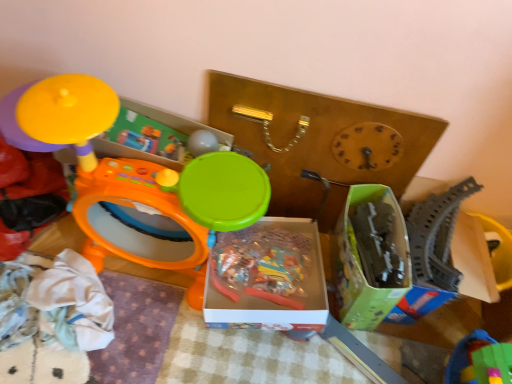
Describe the element at coordinates (25, 181) in the screenshot. This screenshot has height=384, width=512. I see `matte yellow toy at upper left, placed as the 1th toy when sorted from left to right` at that location.

This screenshot has width=512, height=384. Find the location of `green plastic blocks at lower right, which is counted as the 2th toy, starting from the right`. green plastic blocks at lower right, which is counted as the 2th toy, starting from the right is located at coordinates (479, 359).

I want to click on green cardboard box at center-right, the 1th storage box when ordered from right to left, so click(x=370, y=257).

Locate an element on the screen. matte yellow toy at upper left, which is the fourth toy in right-to-left order is located at coordinates 25,181.

Considering the positions of objects matte yellow toy at upper left, which is the fourth toy in right-to-left order, and translucent plastic box at center, the 2th storage box in the right-to-left sequence, in the image provided, who is in front, matte yellow toy at upper left, which is the fourth toy in right-to-left order, or translucent plastic box at center, the 2th storage box in the right-to-left sequence,?

matte yellow toy at upper left, which is the fourth toy in right-to-left order, is closer to the camera.

Considering the relative sizes of matte yellow toy at upper left, placed as the 1th toy when sorted from left to right, and translucent plastic box at center, the 2th storage box in the right-to-left sequence, in the image provided, is matte yellow toy at upper left, placed as the 1th toy when sorted from left to right, smaller than translucent plastic box at center, the 2th storage box in the right-to-left sequence,?

No, matte yellow toy at upper left, placed as the 1th toy when sorted from left to right, is not smaller than translucent plastic box at center, the 2th storage box in the right-to-left sequence.

From a real-world perspective, which object rests below the other?

translucent plastic box at center, which is the first storage box in left-to-right order, from a real-world perspective.

From the image's perspective, which is below, matte yellow toy at upper left, placed as the 1th toy when sorted from left to right, or translucent plastic box at center, which is the first storage box in left-to-right order?

translucent plastic box at center, which is the first storage box in left-to-right order, is shown below in the image.

Can you see translucent plastic box at center, the 2th storage box in the right-to-left sequence, touching green plastic blocks at lower right, the 3th toy viewed from the left?

translucent plastic box at center, the 2th storage box in the right-to-left sequence, and green plastic blocks at lower right, the 3th toy viewed from the left, are not in contact.

In terms of width, does translucent plastic box at center, the 2th storage box in the right-to-left sequence, look wider or thinner when compared to green plastic blocks at lower right, which is counted as the 2th toy, starting from the right?

Considering their sizes, translucent plastic box at center, the 2th storage box in the right-to-left sequence, looks broader than green plastic blocks at lower right, which is counted as the 2th toy, starting from the right.

Who is smaller, translucent plastic box at center, which is the first storage box in left-to-right order, or green plastic blocks at lower right, the 3th toy viewed from the left?

Smaller between the two is green plastic blocks at lower right, the 3th toy viewed from the left.

In the scene shown: From a real-world perspective, which object rests below the other?

From a 3D spatial view, translucent plastic box at center, which is the first storage box in left-to-right order, is below.

Is orange plastic drum at left, positioned as the 2th toy in left-to-right order, in contact with translucent plastic box at center, the 2th storage box in the right-to-left sequence?

There is a gap between orange plastic drum at left, positioned as the 2th toy in left-to-right order, and translucent plastic box at center, the 2th storage box in the right-to-left sequence.

At what (x,y) coordinates should I click in order to perform the action: click on the 2nd storage box behind when counting from the orange plastic drum at left, the 3th toy viewed from the right. Please return your answer as a coordinate pair (x, y). Looking at the image, I should click on (267, 277).

From a real-world perspective, is orange plastic drum at left, positioned as the 2th toy in left-to-right order, above or below translucent plastic box at center, the 2th storage box in the right-to-left sequence?

orange plastic drum at left, positioned as the 2th toy in left-to-right order, is situated higher than translucent plastic box at center, the 2th storage box in the right-to-left sequence, in the real world.

Can you confirm if orange plastic drum at left, the 3th toy viewed from the right, is taller than translucent plastic box at center, the 2th storage box in the right-to-left sequence?

Yes.

From the picture: Who is bigger, gray plastic train track at right, which is the 4th toy in left-to-right order, or translucent plastic box at center, which is the first storage box in left-to-right order?

translucent plastic box at center, which is the first storage box in left-to-right order, is bigger.

There is a translucent plastic box at center, the 2th storage box in the right-to-left sequence. Where is `the 1st toy above it (from the image's perspective)`? This screenshot has width=512, height=384. the 1st toy above it (from the image's perspective) is located at coordinates (436, 236).

Is gray plastic train track at right, which is the 4th toy in left-to-right order, surrounding translucent plastic box at center, which is the first storage box in left-to-right order?

Definitely not — translucent plastic box at center, which is the first storage box in left-to-right order, is not inside gray plastic train track at right, which is the 4th toy in left-to-right order.

Can you tell me how much gray plastic train track at right, positioned as the first toy in right-to-left order, and translucent plastic box at center, the 2th storage box in the right-to-left sequence, differ in facing direction?

The facing directions of gray plastic train track at right, positioned as the first toy in right-to-left order, and translucent plastic box at center, the 2th storage box in the right-to-left sequence, are 7.04 degrees apart.

Considering the relative sizes of gray plastic train track at right, which is the 4th toy in left-to-right order, and green cardboard box at center-right, the 1th storage box when ordered from right to left, in the image provided, is gray plastic train track at right, which is the 4th toy in left-to-right order, wider than green cardboard box at center-right, the 1th storage box when ordered from right to left,?

Incorrect, the width of gray plastic train track at right, which is the 4th toy in left-to-right order, does not surpass that of green cardboard box at center-right, the 1th storage box when ordered from right to left.

Starting from the green cardboard box at center-right, the 1th storage box when ordered from right to left, which toy is the 2nd one to the right? Please provide its 2D coordinates.

[(436, 236)]

How different are the orientations of gray plastic train track at right, positioned as the first toy in right-to-left order, and green cardboard box at center-right, the 1th storage box when ordered from right to left, in degrees?

3.56 degrees.

Looking at this image, from a real-world perspective, who is located lower, gray plastic train track at right, which is the 4th toy in left-to-right order, or green cardboard box at center-right, placed as the 2th storage box when sorted from left to right?

gray plastic train track at right, which is the 4th toy in left-to-right order, from a real-world perspective.

From the image's perspective, between translucent plastic box at center, the 2th storage box in the right-to-left sequence, and matte yellow toy at upper left, placed as the 1th toy when sorted from left to right, who is located below?

From the image's view, translucent plastic box at center, the 2th storage box in the right-to-left sequence, is below.

Is translucent plastic box at center, the 2th storage box in the right-to-left sequence, aimed at matte yellow toy at upper left, placed as the 1th toy when sorted from left to right?

No.

Would you say translucent plastic box at center, the 2th storage box in the right-to-left sequence, is a long distance from matte yellow toy at upper left, placed as the 1th toy when sorted from left to right?

No, translucent plastic box at center, the 2th storage box in the right-to-left sequence, is in close proximity to matte yellow toy at upper left, placed as the 1th toy when sorted from left to right.

From a real-world perspective, is green plastic blocks at lower right, which is counted as the 2th toy, starting from the right, located higher than matte yellow toy at upper left, which is the fourth toy in right-to-left order?

No, from a real-world perspective, green plastic blocks at lower right, which is counted as the 2th toy, starting from the right, is not above matte yellow toy at upper left, which is the fourth toy in right-to-left order.

Looking at this image, is green plastic blocks at lower right, which is counted as the 2th toy, starting from the right, surrounding matte yellow toy at upper left, which is the fourth toy in right-to-left order?

No, matte yellow toy at upper left, which is the fourth toy in right-to-left order, is located outside of green plastic blocks at lower right, which is counted as the 2th toy, starting from the right.

Which is behind, green plastic blocks at lower right, which is counted as the 2th toy, starting from the right, or matte yellow toy at upper left, placed as the 1th toy when sorted from left to right?

Positioned behind is green plastic blocks at lower right, which is counted as the 2th toy, starting from the right.

At what (x,y) coordinates should I click in order to perform the action: click on storage box below the matte yellow toy at upper left, placed as the 1th toy when sorted from left to right (from a real-world perspective). Please return your answer as a coordinate pair (x, y). The image size is (512, 384). Looking at the image, I should click on (267, 277).

Starting from the translucent plastic box at center, which is the first storage box in left-to-right order, which toy is the 1st one to the right? Please provide its 2D coordinates.

[(479, 359)]

From the image, which object appears to be nearer to orange plastic drum at left, positioned as the 2th toy in left-to-right order, matte yellow toy at upper left, placed as the 1th toy when sorted from left to right, or translucent plastic box at center, the 2th storage box in the right-to-left sequence?

Among the two, matte yellow toy at upper left, placed as the 1th toy when sorted from left to right, is located nearer to orange plastic drum at left, positioned as the 2th toy in left-to-right order.

Based on their spatial positions, is gray plastic train track at right, which is the 4th toy in left-to-right order, or translucent plastic box at center, the 2th storage box in the right-to-left sequence, closer to green plastic blocks at lower right, the 3th toy viewed from the left?

gray plastic train track at right, which is the 4th toy in left-to-right order, is closer to green plastic blocks at lower right, the 3th toy viewed from the left.

Which object lies nearer to the anchor point matte yellow toy at upper left, placed as the 1th toy when sorted from left to right, orange plastic drum at left, positioned as the 2th toy in left-to-right order, or gray plastic train track at right, which is the 4th toy in left-to-right order?

orange plastic drum at left, positioned as the 2th toy in left-to-right order, lies closer to matte yellow toy at upper left, placed as the 1th toy when sorted from left to right, than the other object.

Considering their positions, is matte yellow toy at upper left, which is the fourth toy in right-to-left order, positioned further to gray plastic train track at right, positioned as the first toy in right-to-left order, than translucent plastic box at center, which is the first storage box in left-to-right order?

The object further to gray plastic train track at right, positioned as the first toy in right-to-left order, is matte yellow toy at upper left, which is the fourth toy in right-to-left order.

When comparing their distances from green plastic blocks at lower right, the 3th toy viewed from the left, does matte yellow toy at upper left, which is the fourth toy in right-to-left order, or translucent plastic box at center, the 2th storage box in the right-to-left sequence, seem further?

matte yellow toy at upper left, which is the fourth toy in right-to-left order, lies further to green plastic blocks at lower right, the 3th toy viewed from the left, than the other object.

From the image, which object appears to be nearer to gray plastic train track at right, which is the 4th toy in left-to-right order, orange plastic drum at left, the 3th toy viewed from the right, or green plastic blocks at lower right, the 3th toy viewed from the left?

The object closer to gray plastic train track at right, which is the 4th toy in left-to-right order, is green plastic blocks at lower right, the 3th toy viewed from the left.

When comparing their distances from green cardboard box at center-right, the 1th storage box when ordered from right to left, does matte yellow toy at upper left, placed as the 1th toy when sorted from left to right, or green plastic blocks at lower right, the 3th toy viewed from the left, seem closer?

Based on the image, green plastic blocks at lower right, the 3th toy viewed from the left, appears to be nearer to green cardboard box at center-right, the 1th storage box when ordered from right to left.

Looking at the image, which one is located further to green cardboard box at center-right, the 1th storage box when ordered from right to left, orange plastic drum at left, positioned as the 2th toy in left-to-right order, or gray plastic train track at right, positioned as the first toy in right-to-left order?

Based on the image, orange plastic drum at left, positioned as the 2th toy in left-to-right order, appears to be further to green cardboard box at center-right, the 1th storage box when ordered from right to left.

You are a GUI agent. You are given a task and a screenshot of the screen. Output one action in this format:
    pyautogui.click(x=<x>, y=<y>)
    Task: Click on the storage box between orange plastic drum at left, positioned as the 2th toy in left-to-right order, and green cardboard box at center-right, the 1th storage box when ordered from right to left, in the horizontal direction
    The height and width of the screenshot is (384, 512).
    Given the screenshot: What is the action you would take?
    pyautogui.click(x=267, y=277)

This screenshot has height=384, width=512. What are the coordinates of `storage box between translucent plastic box at center, the 2th storage box in the right-to-left sequence, and gray plastic train track at right, which is the 4th toy in left-to-right order, from left to right` in the screenshot? It's located at (370, 257).

In order to click on toy located between green cardboard box at center-right, the 1th storage box when ordered from right to left, and gray plastic train track at right, which is the 4th toy in left-to-right order, in the left-right direction in this screenshot , I will do `click(479, 359)`.

The image size is (512, 384). What are the coordinates of `toy located between translucent plastic box at center, the 2th storage box in the right-to-left sequence, and gray plastic train track at right, which is the 4th toy in left-to-right order, in the left-right direction` in the screenshot? It's located at (479, 359).